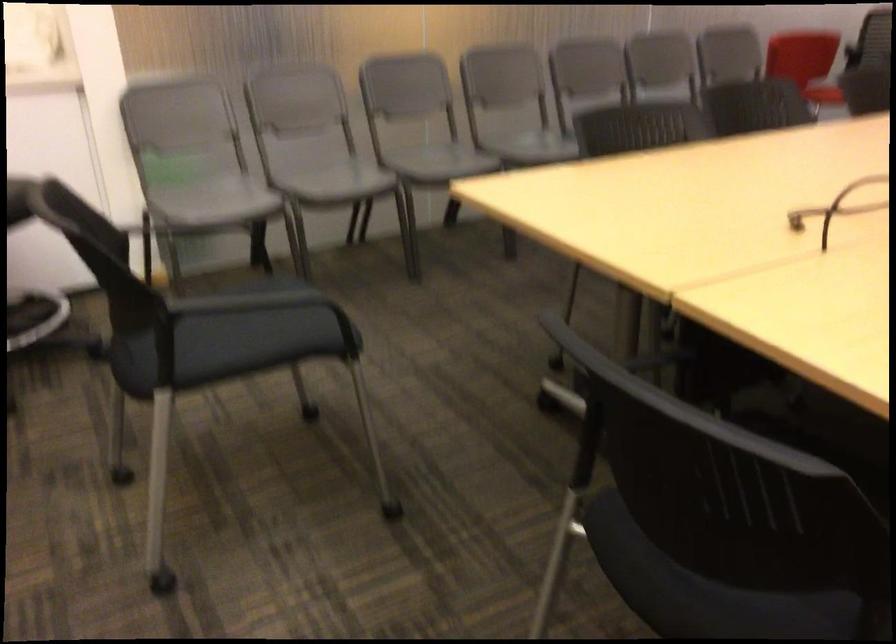
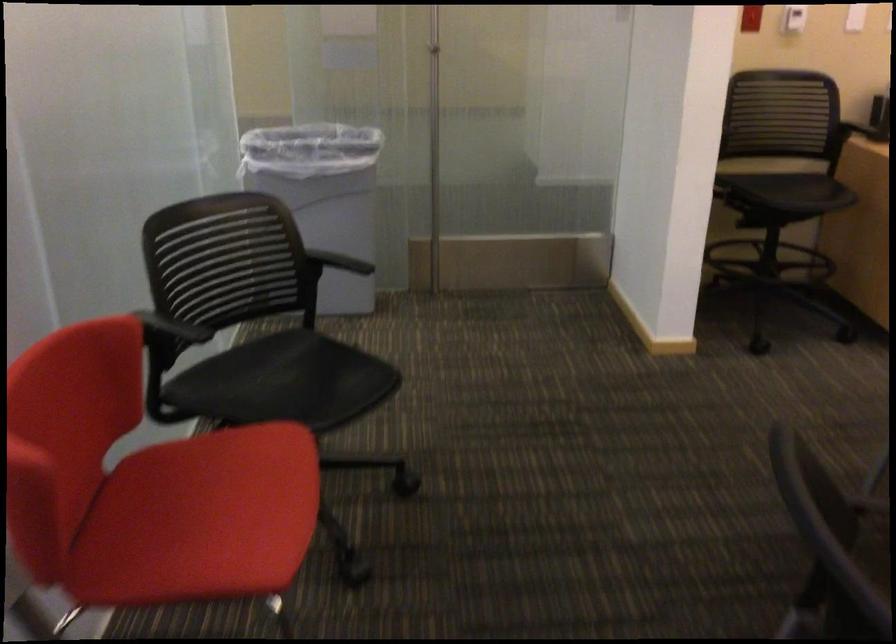
In the second image, find the point that corresponds to point 823,91 in the first image.

(200, 518)